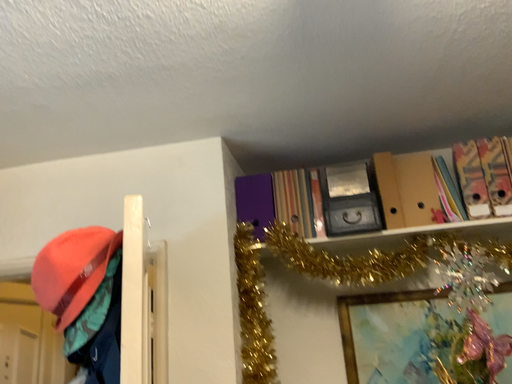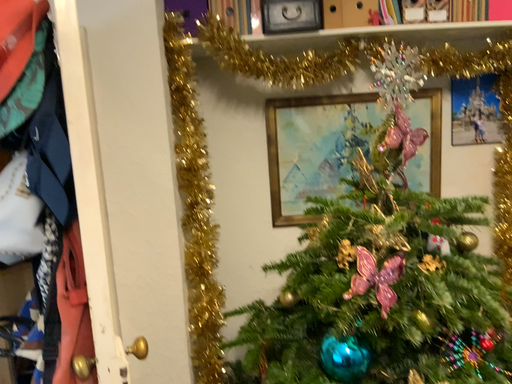
Question: Which way did the camera rotate in the video?

Choices:
 (A) rotated left
 (B) rotated right

Answer: (B)